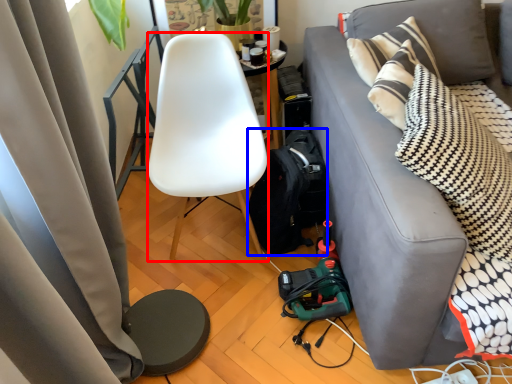
Question: Which point is further to the camera, chair (highlighted by a red box) or backpack (highlighted by a blue box)?

Choices:
 (A) chair
 (B) backpack

Answer: (B)